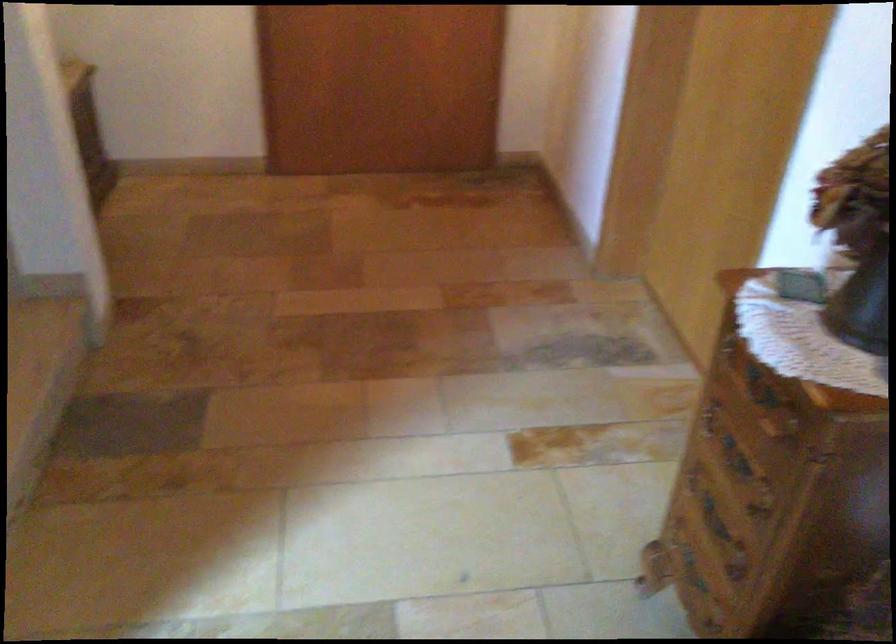
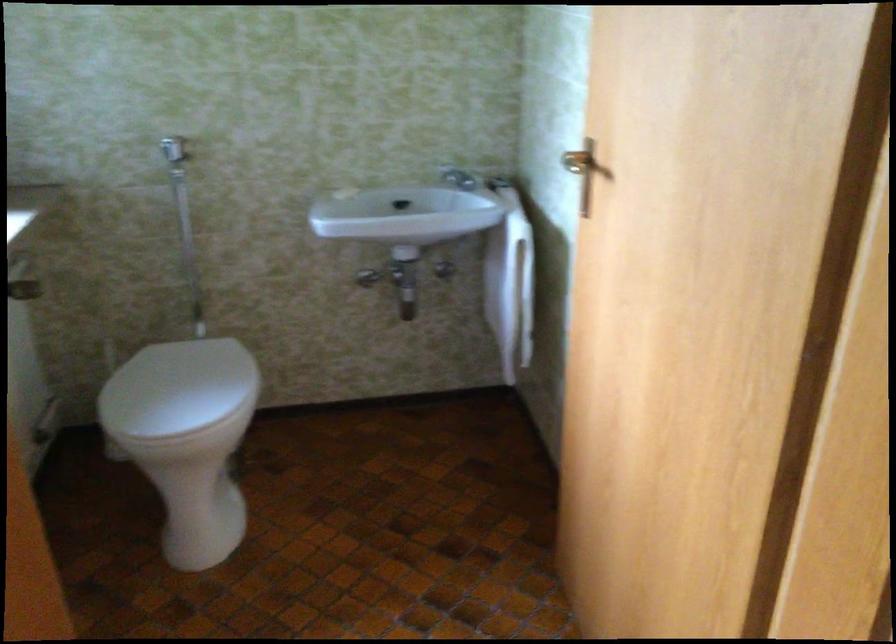
First-person continuous shooting, in which direction is the camera rotating?

The camera rotated toward left-down.